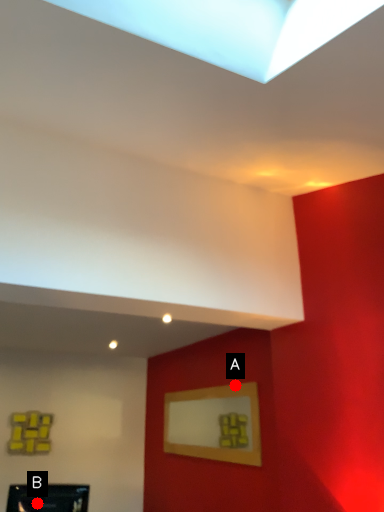
Question: Two points are circled on the image, labeled by A and B beside each circle. Which of the following is the closest to the observer?

Choices:
 (A) A is closer
 (B) B is closer

Answer: (B)